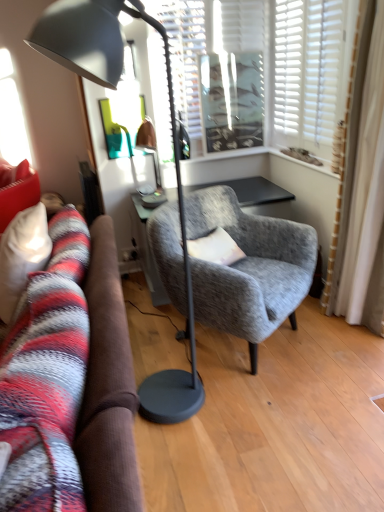
Question: Based on their sizes in the image, would you say textured gray armchair at center is bigger or smaller than matte black floor lamp at left?

Choices:
 (A) big
 (B) small

Answer: (A)

Question: Considering the positions of textured gray armchair at center and matte black floor lamp at left in the image, is textured gray armchair at center wider or thinner than matte black floor lamp at left?

Choices:
 (A) wide
 (B) thin

Answer: (A)

Question: Considering the real-world distances, which object is farthest from the matte black floor lamp at left?

Choices:
 (A) soft gray fabric pillow at center
 (B) textured gray armchair at center
 (C) white textured blinds at upper center

Answer: (C)

Question: Estimate the real-world distances between objects in this image. Which object is closer to the soft gray fabric pillow at center?

Choices:
 (A) matte black floor lamp at left
 (B) white textured blinds at upper center
 (C) textured gray armchair at center

Answer: (C)